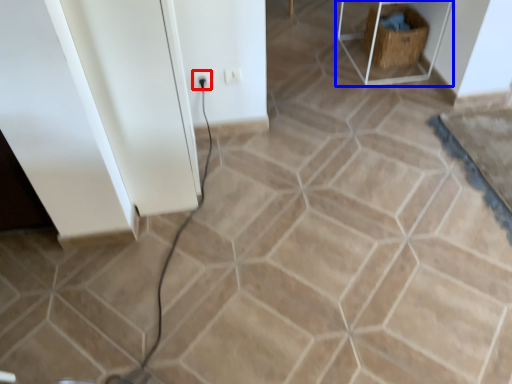
Question: Which object is further to the camera taking this photo, electric outlet (highlighted by a red box) or furniture (highlighted by a blue box)?

Choices:
 (A) electric outlet
 (B) furniture

Answer: (B)